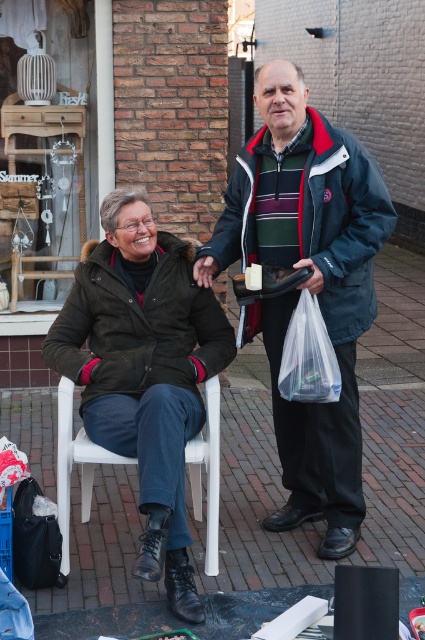
Does matte black jacket at center appear over white plastic chair at lower left?

Correct, matte black jacket at center is located above white plastic chair at lower left.

Is matte black jacket at center bigger than white plastic chair at lower left?

Indeed, matte black jacket at center has a larger size compared to white plastic chair at lower left.

The image size is (425, 640). In order to click on matte black jacket at center in this screenshot , I will do `click(144, 371)`.

At what (x,y) coordinates should I click in order to perform the action: click on matte black jacket at center. Please return your answer as a coordinate pair (x, y). The image size is (425, 640). Looking at the image, I should click on (144, 371).

Is point (181, 380) closer to viewer compared to point (57, 577)?

No.

Is matte black jacket at center bigger than matte black bag at lower left?

Yes, matte black jacket at center is bigger than matte black bag at lower left.

Describe the element at coordinates (144, 371) in the screenshot. I see `matte black jacket at center` at that location.

Where is `matte black jacket at center`? matte black jacket at center is located at coordinates (144, 371).

Is white plastic chair at lower left taller than matte black bag at lower left?

Indeed, white plastic chair at lower left has a greater height compared to matte black bag at lower left.

Is point (87, 508) more distant than point (51, 557)?

Yes, it is behind point (51, 557).

You are a GUI agent. You are given a task and a screenshot of the screen. Output one action in this format:
    pyautogui.click(x=<x>, y=<y>)
    Task: Click on the white plastic chair at lower left
    
    Given the screenshot: What is the action you would take?
    pyautogui.click(x=76, y=461)